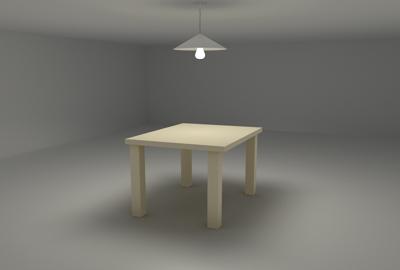
Identify the location of pale color walls. The width and height of the screenshot is (400, 270). (308, 92), (87, 98).